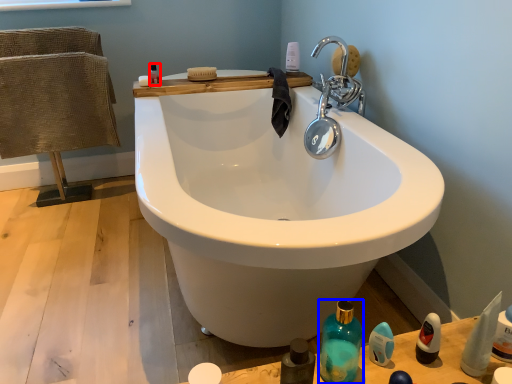
Question: Which object is closer to the camera taking this photo, mouthwash (highlighted by a red box) or bottle (highlighted by a blue box)?

Choices:
 (A) mouthwash
 (B) bottle

Answer: (B)